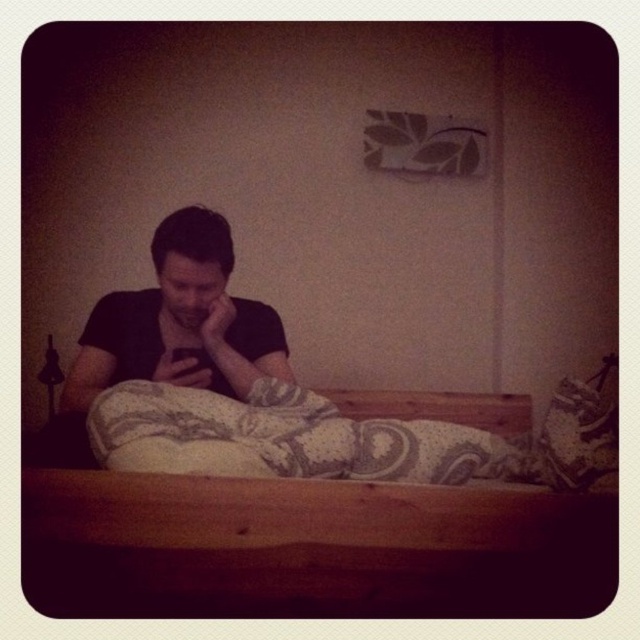
Question: Which object is positioned closest to the wooden bed at center?

Choices:
 (A) matte black hand at lower center
 (B) black matte shirt at center
 (C) black matte hand at center

Answer: (A)

Question: Is black matte shirt at center above matte black hand at lower center?

Choices:
 (A) yes
 (B) no

Answer: (A)

Question: Does wooden bed at center appear over black matte shirt at center?

Choices:
 (A) yes
 (B) no

Answer: (B)

Question: Does wooden bed at center appear on the right side of white patterned pillow at center?

Choices:
 (A) no
 (B) yes

Answer: (A)

Question: Based on their relative distances, which object is nearer to the black matte shirt at center?

Choices:
 (A) white patterned pillow at center
 (B) matte black hand at lower center

Answer: (B)

Question: Which object is positioned farthest from the white patterned pillow at center?

Choices:
 (A) wooden bed at center
 (B) black matte hand at center
 (C) black matte shirt at center
 (D) matte black hand at lower center

Answer: (B)